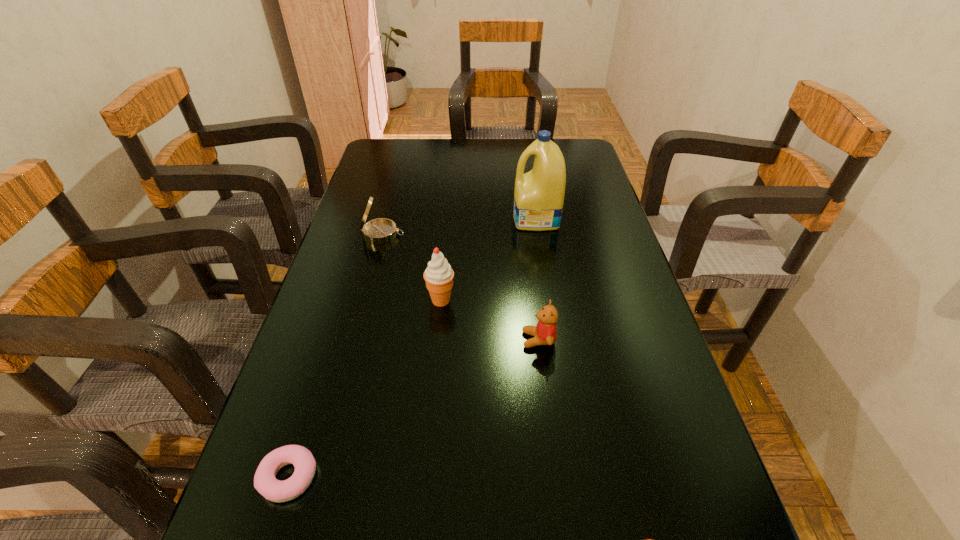
Where is `vacant space at the far edge`? The image size is (960, 540). vacant space at the far edge is located at coordinates (430, 168).

Identify the location of vacant area at the left edge of the desktop. (331, 286).

Where is `vacant area at the right edge of the desktop`? This screenshot has height=540, width=960. vacant area at the right edge of the desktop is located at coordinates (572, 218).

I want to click on vacant space at the far right corner of the desktop, so (566, 144).

Identify the location of vacant region between the tallest object and the fourth object from right to left. (489, 259).

The image size is (960, 540). I want to click on vacant point located between the taller compass and the teddy bear, so click(x=461, y=287).

You are a GUI agent. You are given a task and a screenshot of the screen. Output one action in this format:
    pyautogui.click(x=<x>, y=<y>)
    Task: Click on the empty space that is in between the third nearest object and the farther compass
    This screenshot has width=960, height=540.
    Given the screenshot: What is the action you would take?
    pyautogui.click(x=461, y=287)

Identify the location of vacant area between the teddy bear and the left compass. The width and height of the screenshot is (960, 540). (461, 287).

The width and height of the screenshot is (960, 540). I want to click on vacant space in between the fifth shortest object and the tallest object, so click(489, 259).

The width and height of the screenshot is (960, 540). I want to click on free space between the tallest object and the fifth farthest object, so click(x=413, y=348).